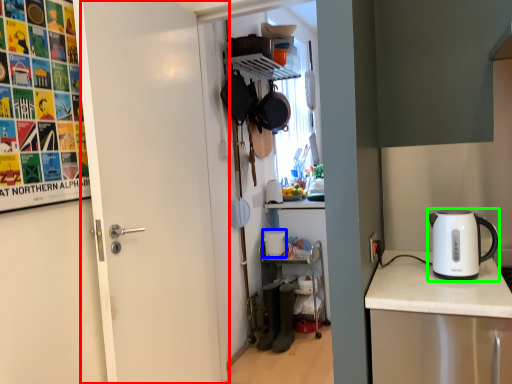
Question: Estimate the real-world distances between objects in this image. Which object is closer to door (highlighted by a red box), appliance (highlighted by a blue box) or kettle (highlighted by a green box)?

Choices:
 (A) appliance
 (B) kettle

Answer: (B)